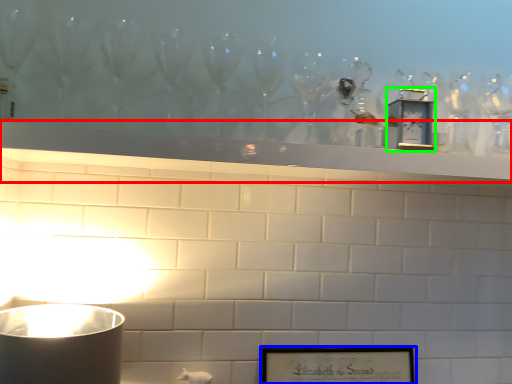
Question: Estimate the real-world distances between objects in this image. Which object is closer to mantle (highlighted by a red box), picture frame (highlighted by a blue box) or clock (highlighted by a green box)?

Choices:
 (A) picture frame
 (B) clock

Answer: (B)